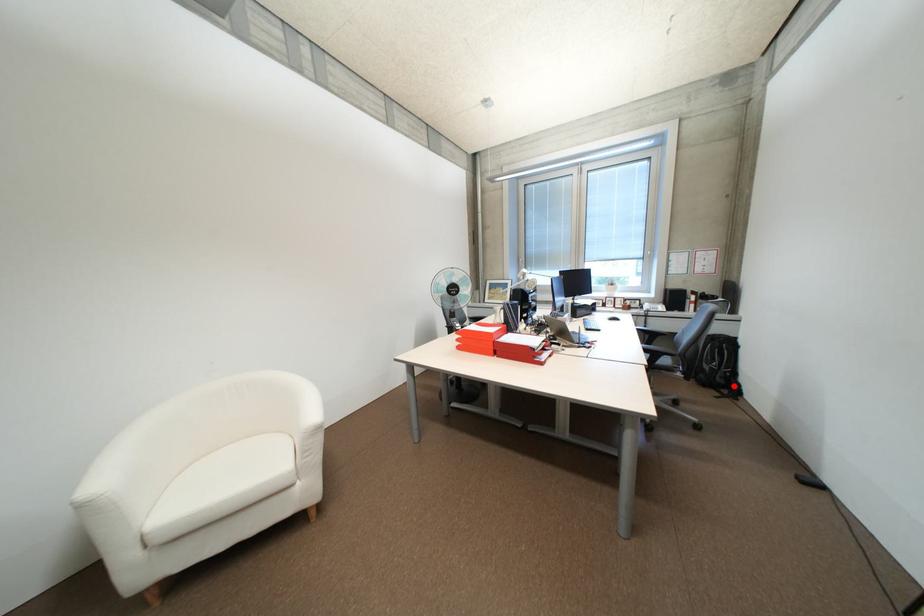
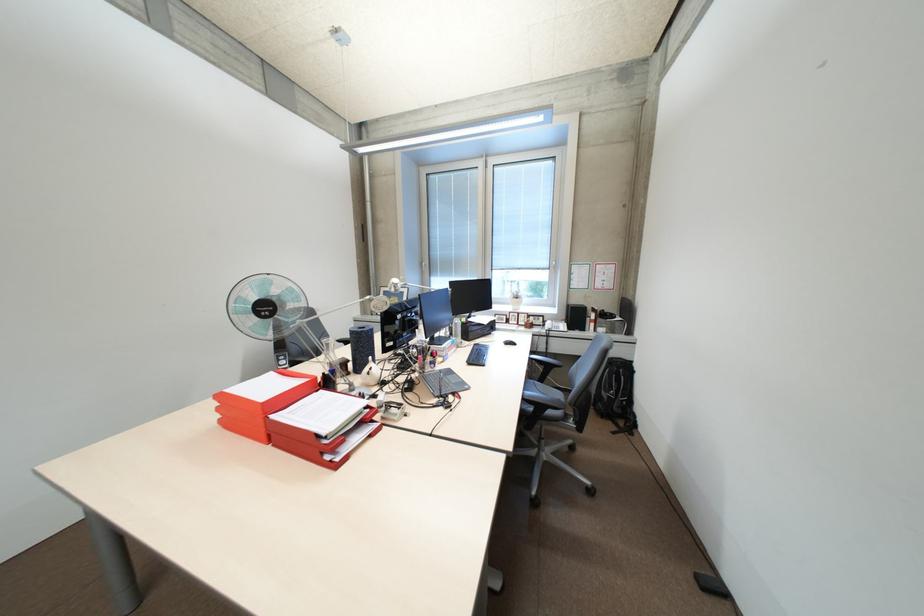
Question: I am providing you with two images of the same scene from different viewpoints. A red point is shown in image1. For the corresponding object point in image2, is it positioned nearer or farther from the camera?

Choices:
 (A) Nearer
 (B) Farther

Answer: (B)